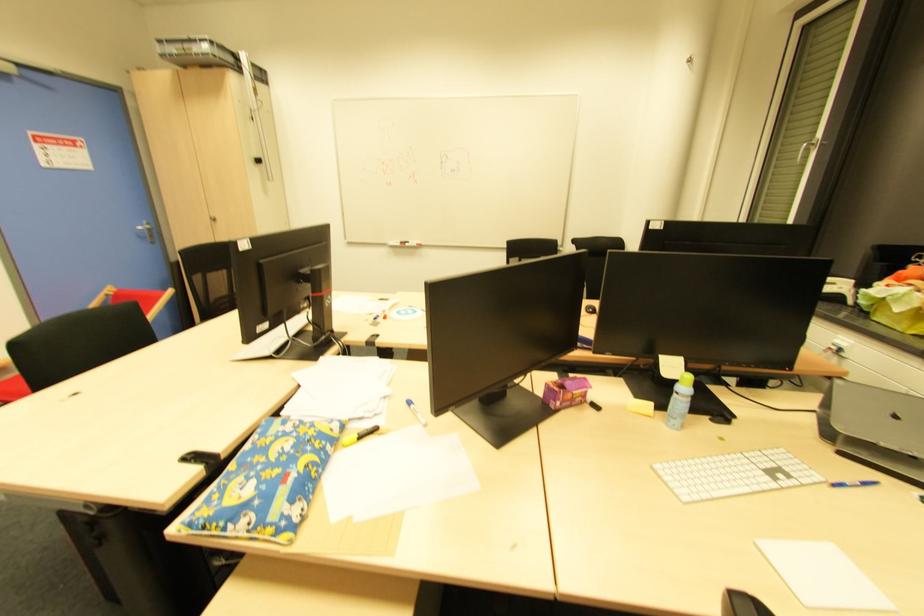
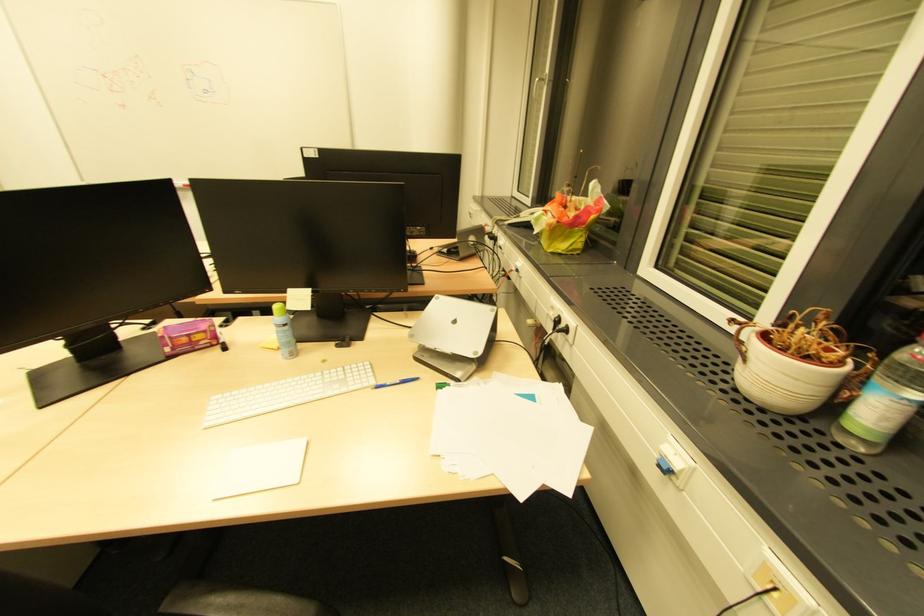
Find the pixel in the second image that matches the point at 805,147 in the first image.

(536, 81)